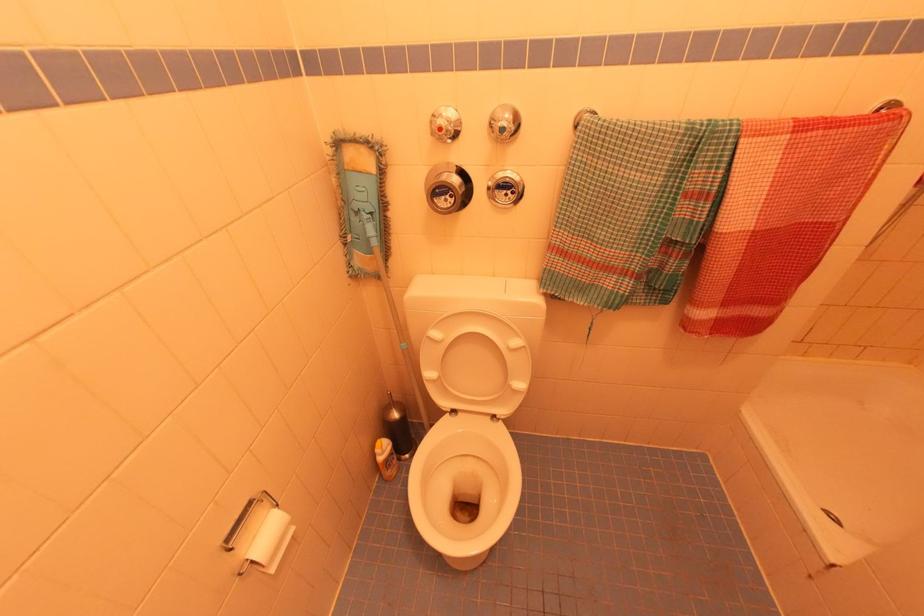
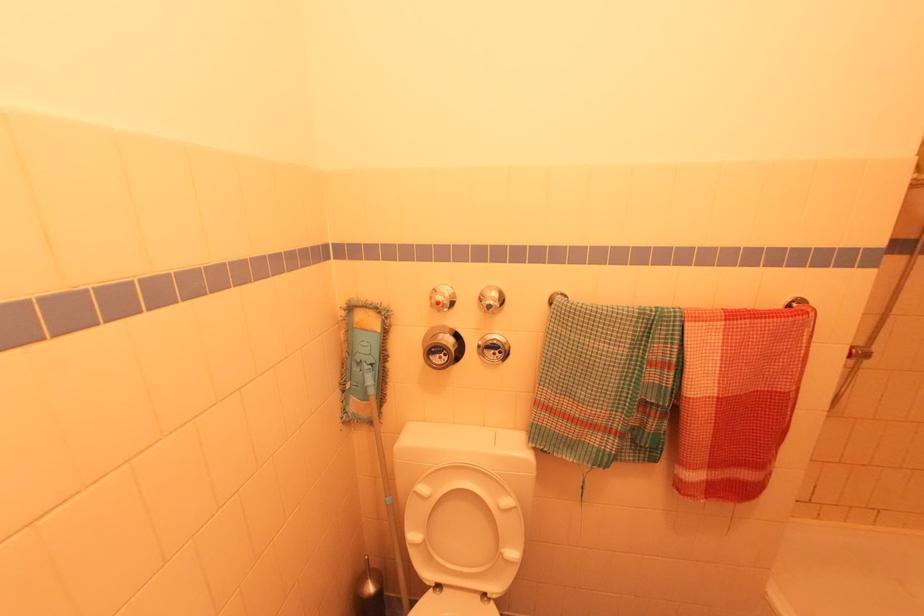
Question: The images are taken continuously from a first-person perspective. In which direction are you moving?

Choices:
 (A) Left
 (B) Right
 (C) Forward
 (D) Backward

Answer: (D)